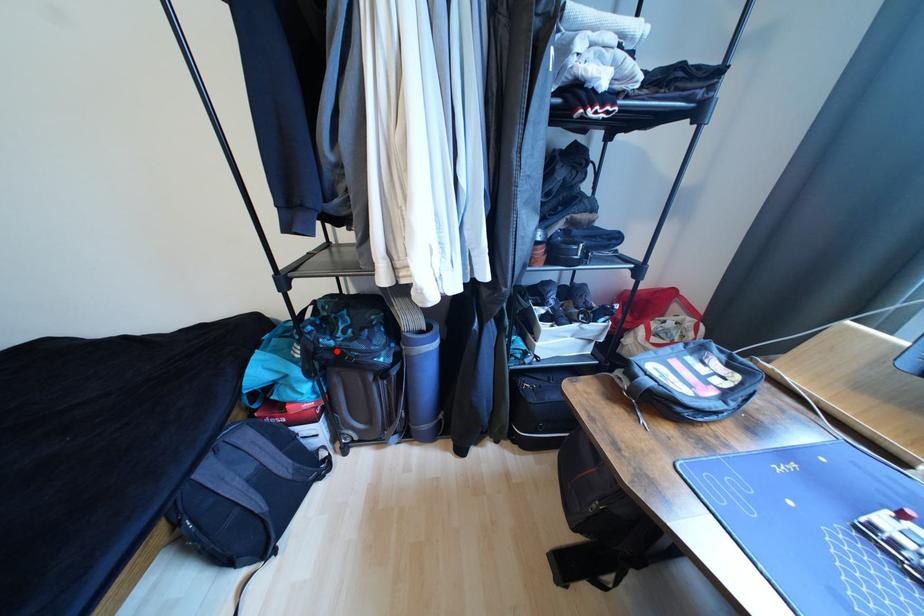
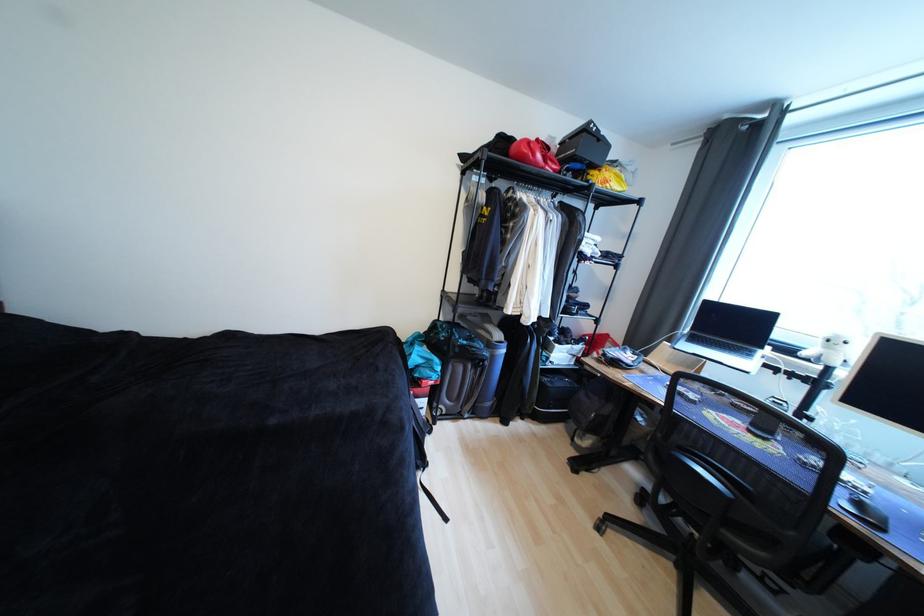
The point at the highlighted location is marked in the first image. Where is the corresponding point in the second image?

(469, 347)